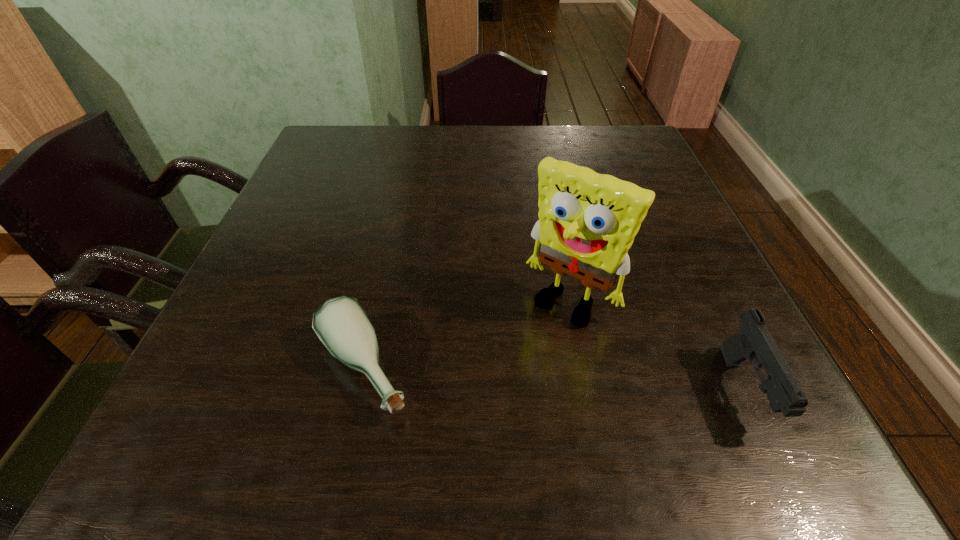
In order to click on free space on the desktop that is between the shortest object and the second tallest object and is positioned on the face of the sponge in this screenshot , I will do `click(515, 377)`.